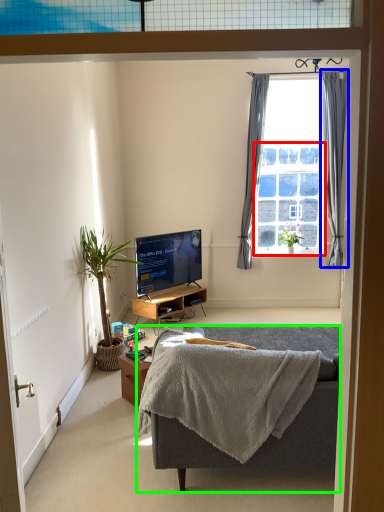
Question: Which object is positioned farthest from bay window (highlighted by a red box)? Select from curtain (highlighted by a blue box) and studio couch (highlighted by a green box).

Choices:
 (A) curtain
 (B) studio couch

Answer: (B)